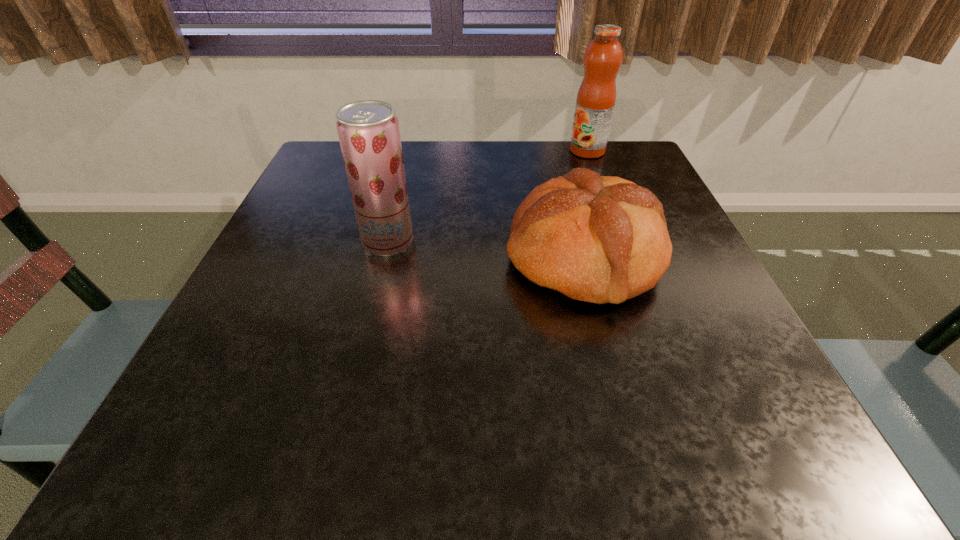
Find the location of `the farthest object`. the farthest object is located at coordinates (596, 97).

The image size is (960, 540). What are the coordinates of `the farther fruit juice` in the screenshot? It's located at (596, 97).

You are a GUI agent. You are given a task and a screenshot of the screen. Output one action in this format:
    pyautogui.click(x=<x>, y=<y>)
    Task: Click on the leftmost object
    Image resolution: width=960 pixels, height=540 pixels.
    Given the screenshot: What is the action you would take?
    pyautogui.click(x=368, y=130)

At what (x,y) coordinates should I click in order to perform the action: click on the left fruit juice. Please return your answer as a coordinate pair (x, y). The width and height of the screenshot is (960, 540). Looking at the image, I should click on (368, 130).

The height and width of the screenshot is (540, 960). I want to click on bread, so click(x=601, y=239).

Locate an element on the screen. blank space located 0.350m on the front label of the farther fruit juice is located at coordinates (435, 151).

Find the location of a particular element. The image size is (960, 540). free location located on the front label of the farther fruit juice is located at coordinates (469, 151).

At what (x,y) coordinates should I click in order to perform the action: click on blank space located on the front label of the farther fruit juice. Please return your answer as a coordinate pair (x, y). The height and width of the screenshot is (540, 960). Looking at the image, I should click on (550, 151).

Locate an element on the screen. vacant space located on the right of the left fruit juice is located at coordinates click(439, 242).

This screenshot has width=960, height=540. What are the coordinates of `free point located 0.230m on the back of the bread` in the screenshot? It's located at (559, 160).